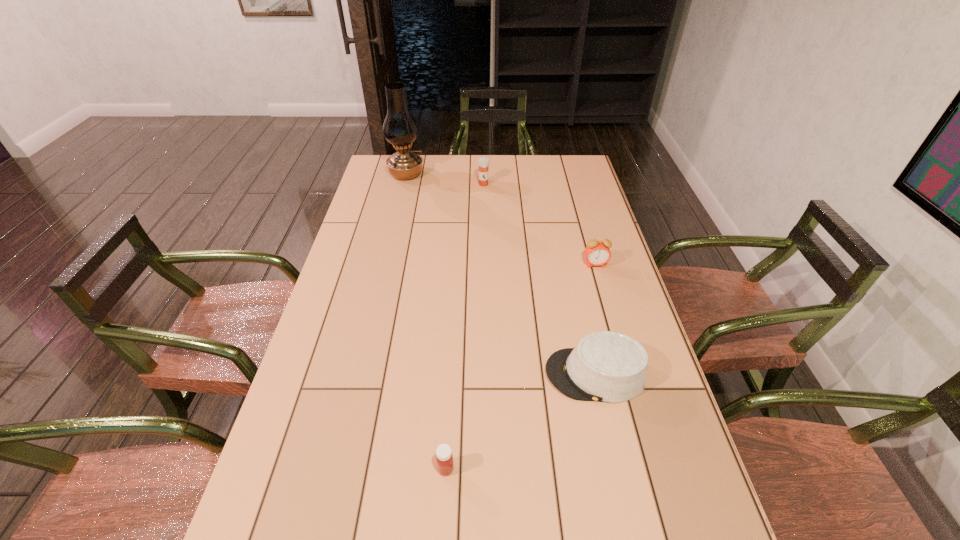
Locate an element on the screen. Image resolution: width=960 pixels, height=540 pixels. object that is at the far left corner is located at coordinates (400, 129).

Locate an element on the screen. vacant space at the far edge of the desktop is located at coordinates 523,173.

The image size is (960, 540). I want to click on vacant space at the left edge of the desktop, so click(374, 222).

The height and width of the screenshot is (540, 960). In order to click on free space at the right edge of the desktop in this screenshot , I will do `click(695, 528)`.

In order to click on free location at the far right corner in this screenshot , I will do `click(586, 182)`.

The height and width of the screenshot is (540, 960). I want to click on free space between the hat and the alarm clock, so click(x=595, y=319).

Locate an element on the screen. vacant point located between the hat and the third nearest object is located at coordinates (595, 319).

This screenshot has width=960, height=540. Find the location of `vacant area that lies between the leftmost object and the second object from left to right`. vacant area that lies between the leftmost object and the second object from left to right is located at coordinates (426, 321).

This screenshot has height=540, width=960. In order to click on free spot between the fourth farthest object and the tallest object in this screenshot , I will do `click(501, 274)`.

At what (x,y) coordinates should I click in order to perform the action: click on empty location between the alarm clock and the nearer medicine. Please return your answer as a coordinate pair (x, y). The height and width of the screenshot is (540, 960). Looking at the image, I should click on (520, 367).